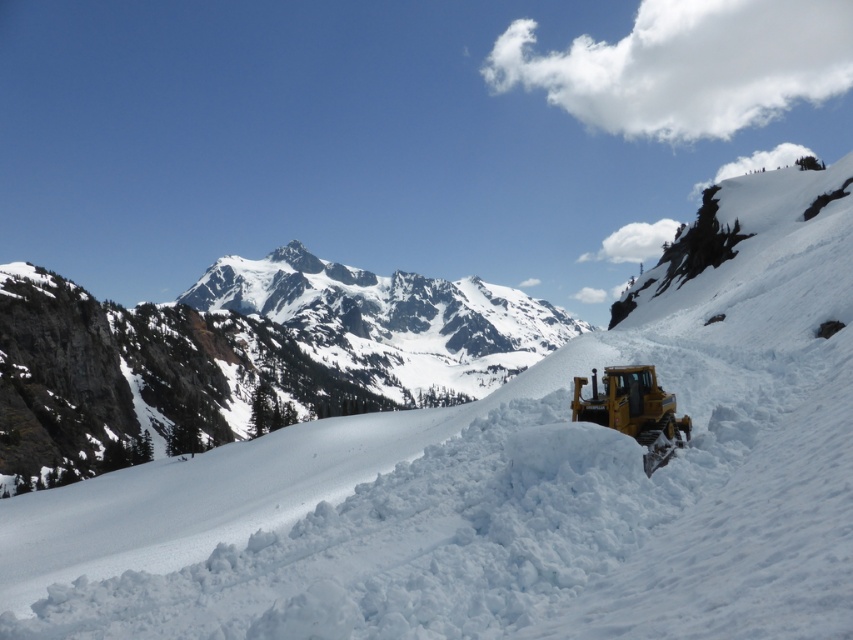
Question: Where is snowy rocky mountain at center located in relation to yellow metallic plow at center-right in the image?

Choices:
 (A) above
 (B) below

Answer: (A)

Question: Does snowy rocky mountain at center have a larger size compared to yellow metallic plow at center-right?

Choices:
 (A) yes
 (B) no

Answer: (A)

Question: Is the position of snowy rocky mountain at center more distant than that of yellow metallic plow at center-right?

Choices:
 (A) no
 (B) yes

Answer: (B)

Question: Which of the following is the farthest from the observer?

Choices:
 (A) (686, 433)
 (B) (123, 323)

Answer: (B)

Question: Which object appears closest to the camera in this image?

Choices:
 (A) yellow metallic plow at center-right
 (B) snowy rocky mountain at center

Answer: (A)

Question: Which point is farther to the camera?

Choices:
 (A) (662, 429)
 (B) (534, 356)

Answer: (B)